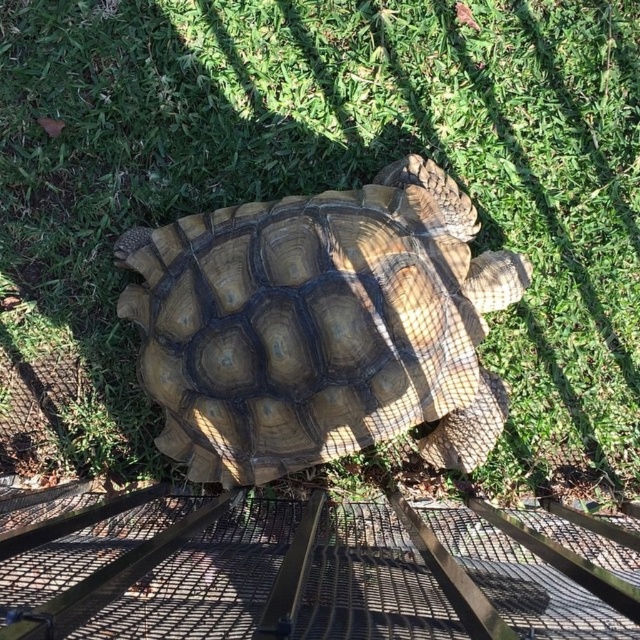
Is brown textured shell at center taller than metal mesh fence at lower center?

Indeed, brown textured shell at center has a greater height compared to metal mesh fence at lower center.

Who is taller, brown textured shell at center or metal mesh fence at lower center?

brown textured shell at center

Describe the element at coordinates (321, 326) in the screenshot. I see `brown textured shell at center` at that location.

Where is `brown textured shell at center`? The width and height of the screenshot is (640, 640). brown textured shell at center is located at coordinates (321, 326).